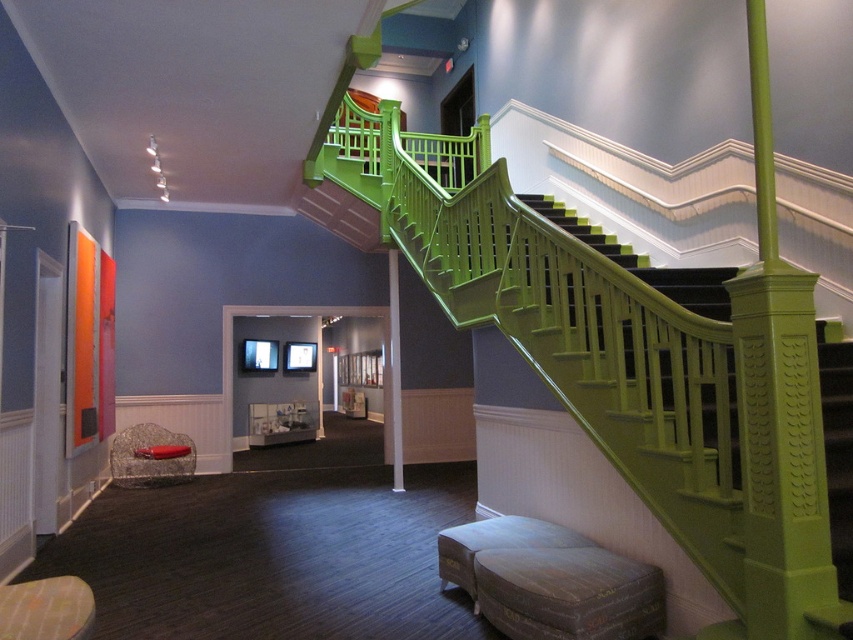
Question: Does distressed brown leather stool at lower center appear on the right side of velvet grey ottoman at lower center?

Choices:
 (A) no
 (B) yes

Answer: (B)

Question: Which object appears farthest from the camera in this image?

Choices:
 (A) velvet grey ottoman at lower center
 (B) distressed brown leather stool at lower center

Answer: (A)

Question: Can you confirm if distressed brown leather stool at lower center is bigger than velvet grey ottoman at lower center?

Choices:
 (A) yes
 (B) no

Answer: (B)

Question: Which point appears farthest from the camera in this image?

Choices:
 (A) (483, 582)
 (B) (486, 522)

Answer: (B)

Question: Is distressed brown leather stool at lower center smaller than velvet grey ottoman at lower center?

Choices:
 (A) yes
 (B) no

Answer: (A)